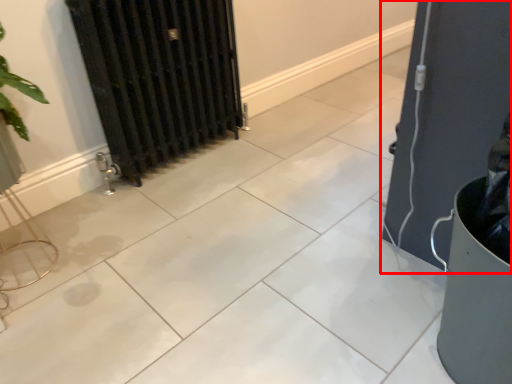
Question: From the image's perspective, what is the correct spatial positioning of door (annotated by the red box) in reference to radiator?

Choices:
 (A) below
 (B) above

Answer: (A)